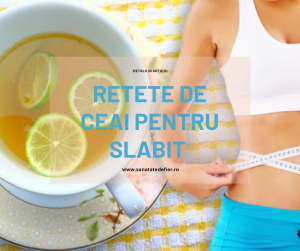
This screenshot has height=251, width=300. Identify the location of leaf patterns on plate. (88, 229), (113, 217), (83, 216).